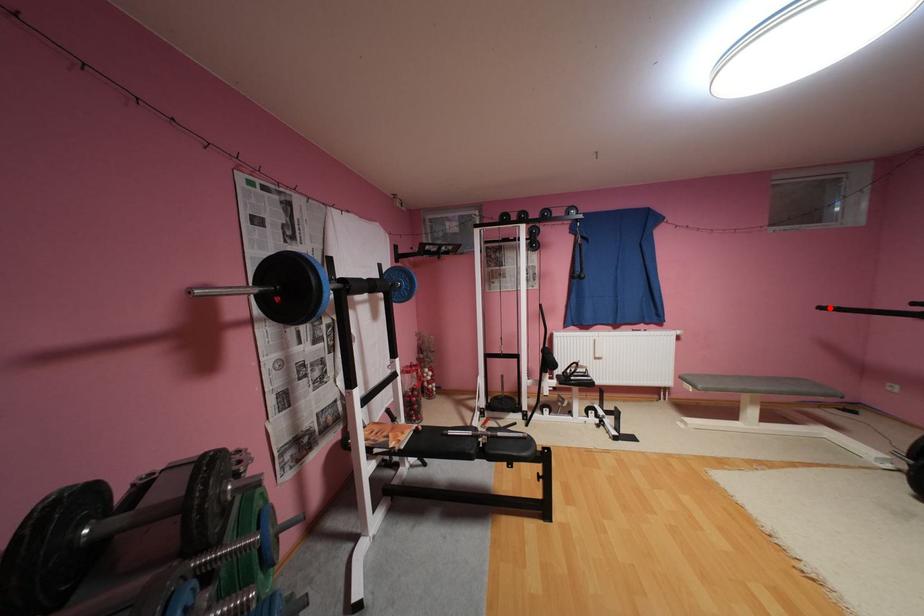
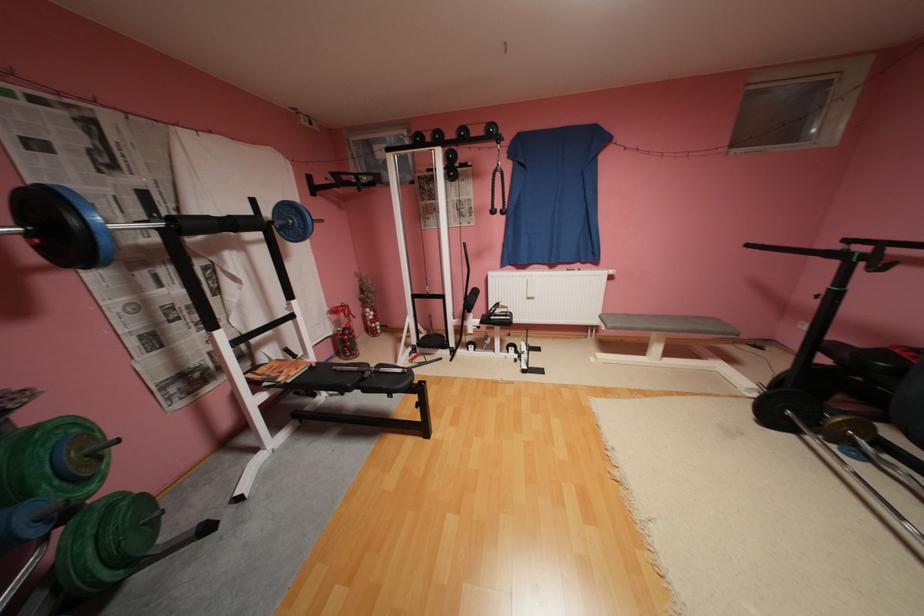
In the second image, find the point that corresponds to the highlighted location in the first image.

(757, 246)